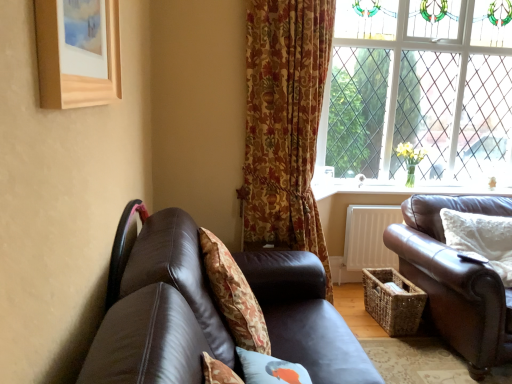
Question: From their relative heights in the image, would you say floral fabric cushion at center, which is counted as the 2th pillow, starting from the front, is taller or shorter than white painted wood at lower right?

Choices:
 (A) short
 (B) tall

Answer: (B)

Question: Considering the positions of floral fabric cushion at center, the third pillow positioned from the right, and white painted wood at lower right in the image, is floral fabric cushion at center, the third pillow positioned from the right, bigger or smaller than white painted wood at lower right?

Choices:
 (A) small
 (B) big

Answer: (B)

Question: Estimate the real-world distances between objects in this image. Which object is closer to the white painted wood at lower right?

Choices:
 (A) brown leather couch at right, arranged as the 2th studio couch when viewed from the left
 (B) brown leather couch at lower left, the first studio couch in the left-to-right sequence
 (C) clear glass window at upper right
 (D) floral fabric curtain at center
 (E) leather chair at left

Answer: (C)

Question: Estimate the real-world distances between objects in this image. Which object is closer to the floral fabric curtain at center?

Choices:
 (A) brown leather couch at lower left, the first studio couch in the left-to-right sequence
 (B) leather chair at left
 (C) floral fabric cushion at center, which is counted as the 2th pillow, starting from the front
 (D) wooden picture frame at upper left
 (E) white painted wood at lower right

Answer: (E)